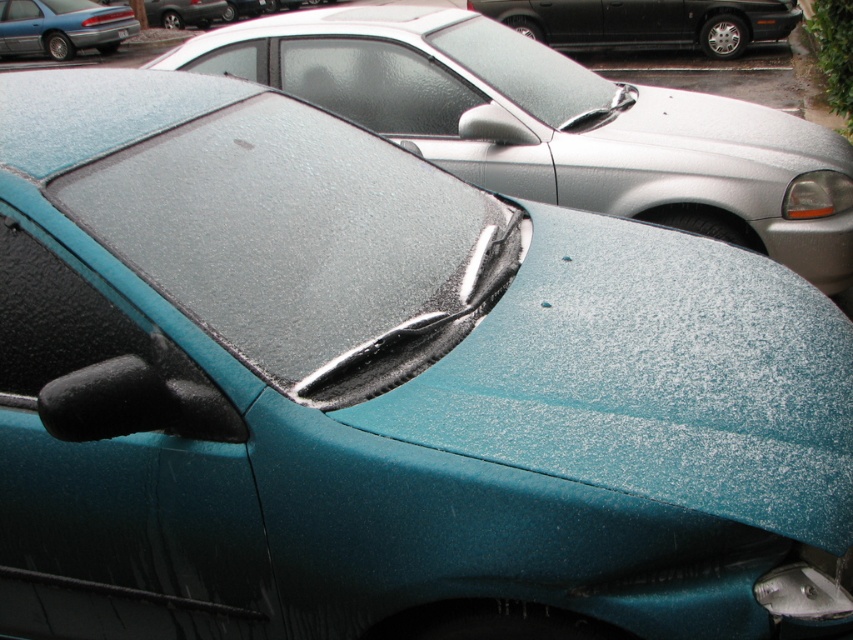
Who is lower down, frosted glass windshield at center or black plastic license plate at center?

frosted glass windshield at center is lower down.

Can you confirm if frosted glass windshield at center is positioned to the left of black plastic license plate at center?

Incorrect, frosted glass windshield at center is not on the left side of black plastic license plate at center.

Does point (321, 81) come closer to viewer compared to point (125, 32)?

Yes, it is in front of point (125, 32).

Identify the location of frosted glass windshield at center. The image size is (853, 640). (375, 83).

Is point (213, 182) in front of point (48, 35)?

Yes, it is.

Can you confirm if glossy plastic windshield at center is positioned to the right of teal glossy sedan at upper left?

Indeed, glossy plastic windshield at center is positioned on the right side of teal glossy sedan at upper left.

Where is `glossy plastic windshield at center`? glossy plastic windshield at center is located at coordinates (302, 243).

Between glossy black car at upper center and teal glossy sedan at upper left, which one is positioned higher?

teal glossy sedan at upper left

In the scene shown: Which of these two, glossy black car at upper center or teal glossy sedan at upper left, stands shorter?

Standing shorter between the two is glossy black car at upper center.

Is point (721, 22) farther from camera compared to point (73, 42)?

No.

Locate an element on the screen. This screenshot has height=640, width=853. glossy black car at upper center is located at coordinates (646, 22).